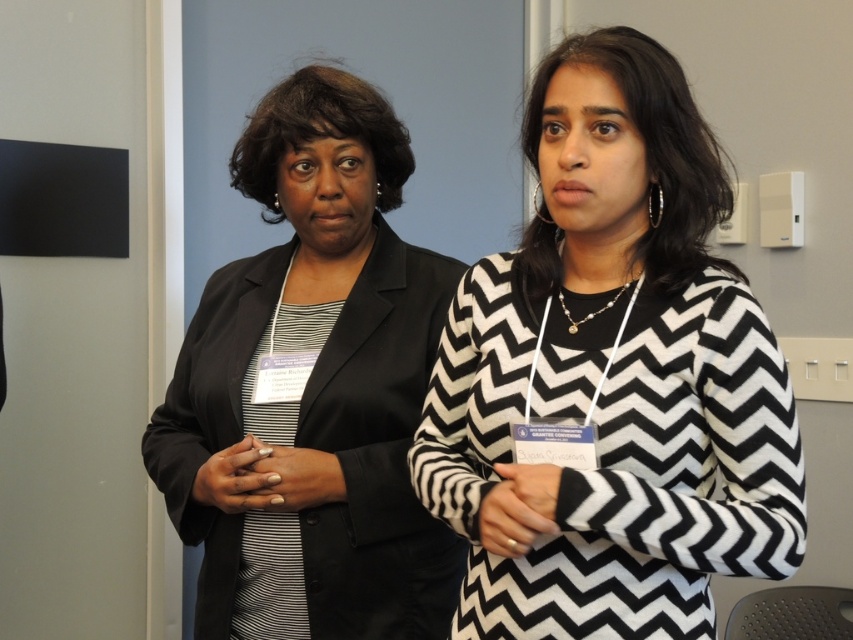
You are a photographer standing at the entrance of the room. You need to take a portrait of the black and white zigzag sweater at center. What is the minimum distance you should maintain to ensure the entire sweater fits in the frame?

The minimum distance should be at least 98.45 centimeters to ensure the entire black and white zigzag sweater at center fits in the frame.

In the scene shown: You are at a conference and need to take a photo of the black and white zigzag sweater at center and the black satin blazer at left. Which one is closer to the camera?

The black and white zigzag sweater at center is closer to the camera because it is in front of the black satin blazer at left.

You are organizing a coat rack for attendees at the event. If you want to hang both the black and white zigzag sweater at center and the black satin blazer at left, which one will require less space on the coat rack?

The black and white zigzag sweater at center is thinner than the black satin blazer at left, so it will require less space on the coat rack.